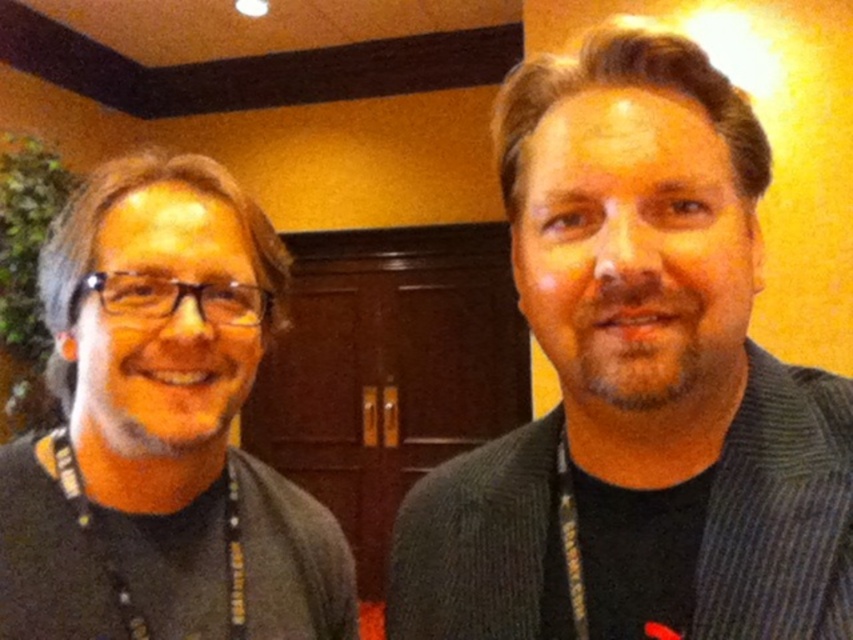
From the picture: Can you confirm if dark gray sweater at right is bigger than matte black glasses at left?

Indeed, dark gray sweater at right has a larger size compared to matte black glasses at left.

Which is more to the left, dark gray sweater at right or matte black glasses at left?

matte black glasses at left is more to the left.

Is point (668, 180) behind point (161, 312)?

No, it is not.

I want to click on dark gray sweater at right, so click(637, 385).